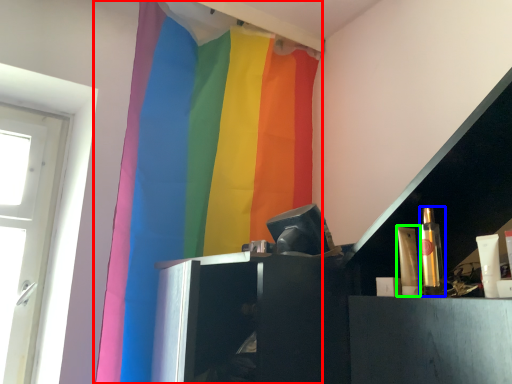
Question: Which object is positioned farthest from curtain (highlighted by a red box)? Select from toiletry (highlighted by a blue box) and toiletry (highlighted by a green box).

Choices:
 (A) toiletry
 (B) toiletry

Answer: (A)